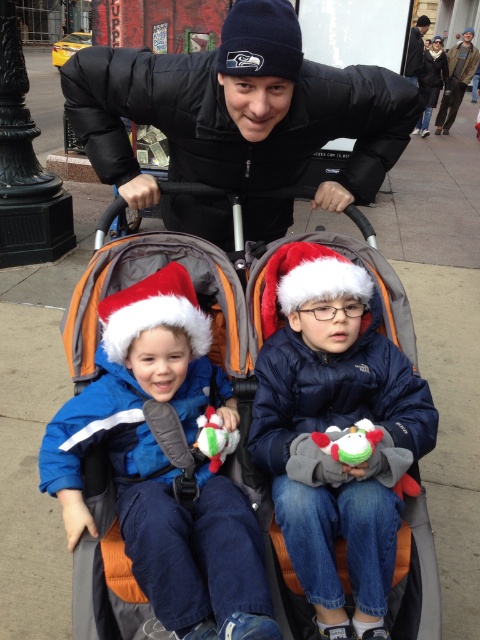
Can you confirm if black matte jacket at upper center is shorter than navy blue jacket at center?

Indeed, black matte jacket at upper center has a lesser height compared to navy blue jacket at center.

Is point (141, 93) closer to camera compared to point (312, 560)?

No, it is behind (312, 560).

Where is `black matte jacket at upper center`? The image size is (480, 640). black matte jacket at upper center is located at coordinates (240, 109).

Can you confirm if orange fabric baby carriage at center is wider than blue fleece jacket at left?

Yes, orange fabric baby carriage at center is wider than blue fleece jacket at left.

The height and width of the screenshot is (640, 480). What do you see at coordinates (228, 404) in the screenshot?
I see `orange fabric baby carriage at center` at bounding box center [228, 404].

Where is `orange fabric baby carriage at center`? The image size is (480, 640). orange fabric baby carriage at center is located at coordinates (x=228, y=404).

Is dark blue knit hat at upper center to the right of black leather jacket at upper center from the viewer's perspective?

Indeed, dark blue knit hat at upper center is positioned on the right side of black leather jacket at upper center.

Between dark blue knit hat at upper center and black leather jacket at upper center, which one is positioned higher?

dark blue knit hat at upper center is higher up.

The image size is (480, 640). What do you see at coordinates (456, 80) in the screenshot?
I see `dark blue knit hat at upper center` at bounding box center [456, 80].

Find the location of `dark blue knit hat at upper center`. dark blue knit hat at upper center is located at coordinates (456, 80).